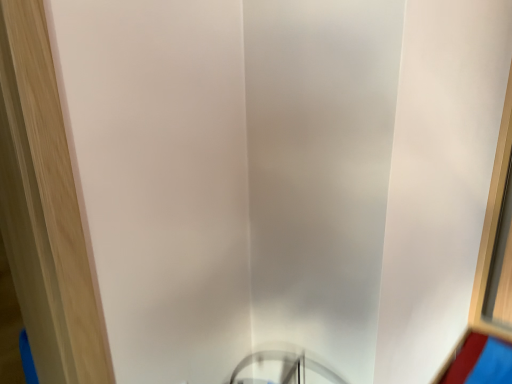
I want to click on clear glass window at right, so click(x=496, y=240).

This screenshot has width=512, height=384. What do you see at coordinates (496, 240) in the screenshot? I see `clear glass window at right` at bounding box center [496, 240].

Identify the location of clear glass window at right. Image resolution: width=512 pixels, height=384 pixels. (496, 240).